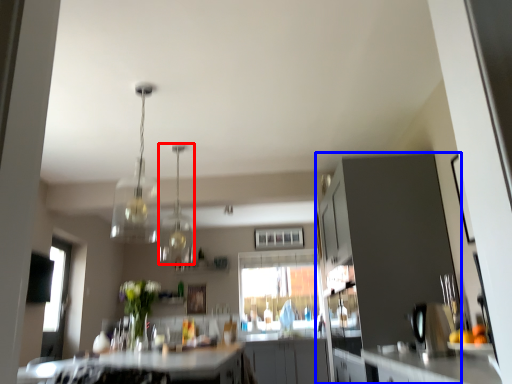
Question: Which point is further to the camera, light fixture (highlighted by a red box) or cabinetry (highlighted by a blue box)?

Choices:
 (A) light fixture
 (B) cabinetry

Answer: (A)